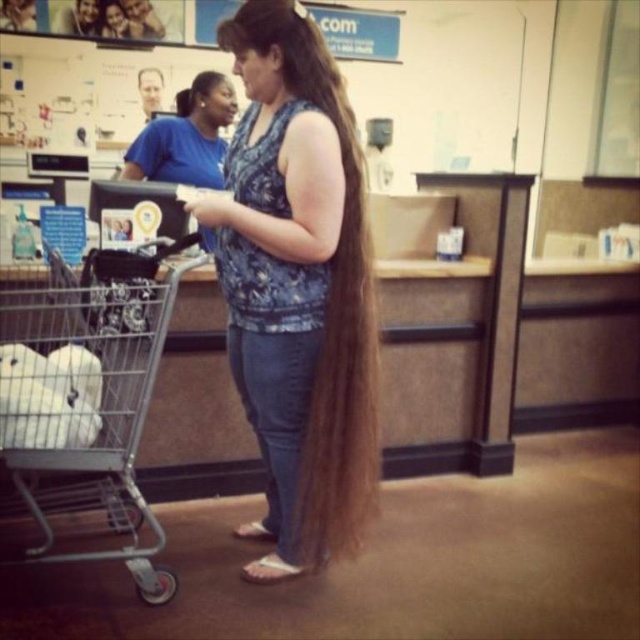
You are a fashion designer observing a woman wearing a blue printed tank top at center and a blue fabric shirt at center. You want to know if the two items can be displayed together on a mannequin. Can they be placed side by side without overlapping?

The distance between the blue printed tank top at center and the blue fabric shirt at center is 1.09 meters. Since the items are separated by this distance, they can be displayed side by side on a mannequin without overlapping as they are not overlapping in the original image.

In the scene shown: What is located at the coordinates point (186, 136) in the image?

The point (186, 136) indicates the blue fabric shirt at center.

You are a customer in a store and you want to grab your shopping cart. Which object is closer to you, the blue printed tank top at center or the silver wire shopping cart at left?

The silver wire shopping cart at left is behind the blue printed tank top at center, so the blue printed tank top at center is closer to you.